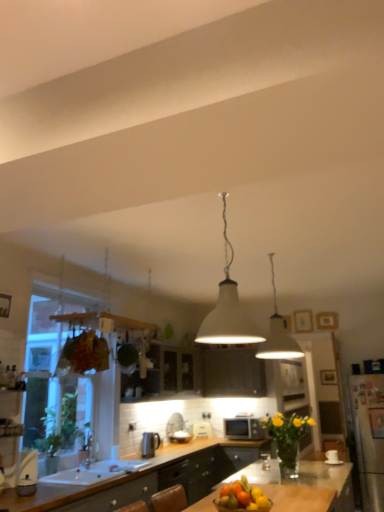
Question: Is white matte lampshade at center, which is the 1th lamp in right-to-left order, further to the viewer compared to white glossy toaster at center, the 1th appliance viewed from the left?

Choices:
 (A) yes
 (B) no

Answer: (B)

Question: Is white matte lampshade at center, the second lamp from the front, positioned far away from white glossy toaster at center, which appears as the 2th appliance when viewed from the back?

Choices:
 (A) no
 (B) yes

Answer: (B)

Question: Does white matte lampshade at center, the second lamp from the front, appear on the left side of white glossy toaster at center, the 1th appliance viewed from the left?

Choices:
 (A) yes
 (B) no

Answer: (B)

Question: Considering the relative positions of white matte lampshade at center, arranged as the second lamp when viewed from the left, and white glossy toaster at center, the 1th appliance viewed from the left, in the image provided, is white matte lampshade at center, arranged as the second lamp when viewed from the left, to the right of white glossy toaster at center, the 1th appliance viewed from the left, from the viewer's perspective?

Choices:
 (A) yes
 (B) no

Answer: (A)

Question: From the image's perspective, is white matte lampshade at center, which is the 1th lamp in right-to-left order, below white glossy toaster at center, the 1th appliance viewed from the left?

Choices:
 (A) yes
 (B) no

Answer: (B)

Question: Choose the correct answer: Is white matte lampshade at center, the second lamp in the right-to-left sequence, inside white glossy cabinet at center or outside it?

Choices:
 (A) inside
 (B) outside

Answer: (B)

Question: Is white matte lampshade at center, the second lamp when ordered from back to front, wider or thinner than white glossy cabinet at center?

Choices:
 (A) thin
 (B) wide

Answer: (B)

Question: Considering their positions, is white matte lampshade at center, the second lamp when ordered from back to front, located in front of or behind white glossy cabinet at center?

Choices:
 (A) front
 (B) behind

Answer: (A)

Question: Considering the positions of point (243, 309) and point (155, 343), is point (243, 309) closer or farther from the camera than point (155, 343)?

Choices:
 (A) closer
 (B) farther

Answer: (B)

Question: From their relative heights in the image, would you say white matte lampshade at center, the second lamp from the front, is taller or shorter than white glossy toaster at center, which appears as the 2th appliance when viewed from the back?

Choices:
 (A) short
 (B) tall

Answer: (B)

Question: Is white matte lampshade at center, marked as the 1th lamp in a back-to-front arrangement, wider or thinner than white glossy toaster at center, placed as the 2th appliance when sorted from right to left?

Choices:
 (A) thin
 (B) wide

Answer: (B)

Question: From a real-world perspective, is white matte lampshade at center, arranged as the second lamp when viewed from the left, above or below white glossy toaster at center, the 1th appliance viewed from the left?

Choices:
 (A) below
 (B) above

Answer: (B)

Question: Considering their positions, is white matte lampshade at center, arranged as the second lamp when viewed from the left, located in front of or behind white glossy toaster at center, the 1th appliance viewed from the left?

Choices:
 (A) front
 (B) behind

Answer: (A)

Question: Is white glossy sink at lower left wider or thinner than transparent glass window at left?

Choices:
 (A) thin
 (B) wide

Answer: (B)

Question: Which is correct: white glossy sink at lower left is inside transparent glass window at left, or outside of it?

Choices:
 (A) outside
 (B) inside

Answer: (A)